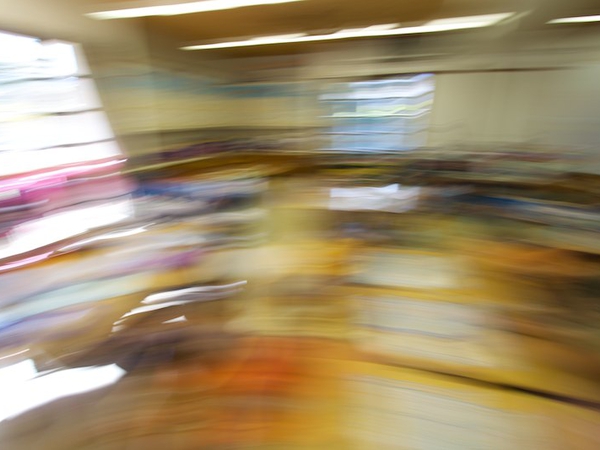
Locate an element on the screen. window is located at coordinates (23, 157).